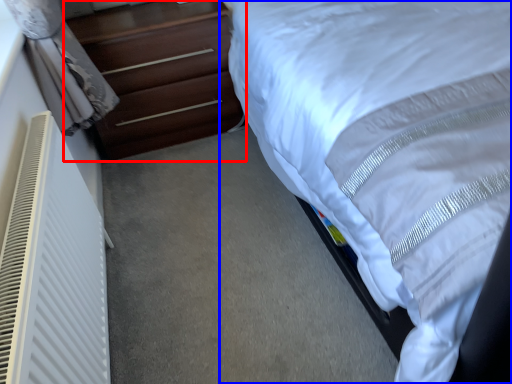
Question: Which of the following is the farthest to the observer, chest of drawers (highlighted by a red box) or bed (highlighted by a blue box)?

Choices:
 (A) chest of drawers
 (B) bed

Answer: (A)